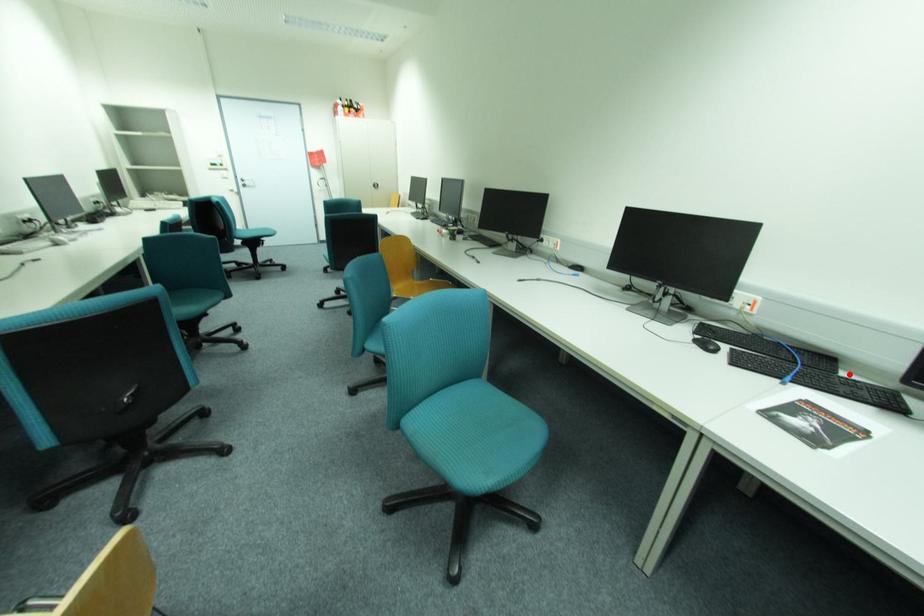
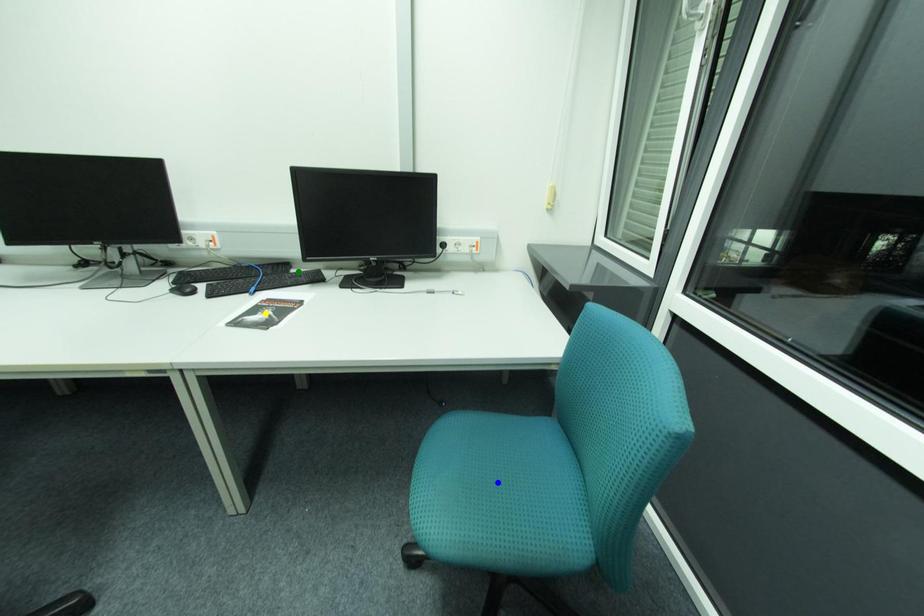
Question: I am providing you with two images of the same scene from different viewpoints. A red point is marked on the first image. You are given multiple points on the second image. Which point in image 2 represents the same 3d spot as the red point in image 1?

Choices:
 (A) yellow point
 (B) blue point
 (C) green point

Answer: (C)